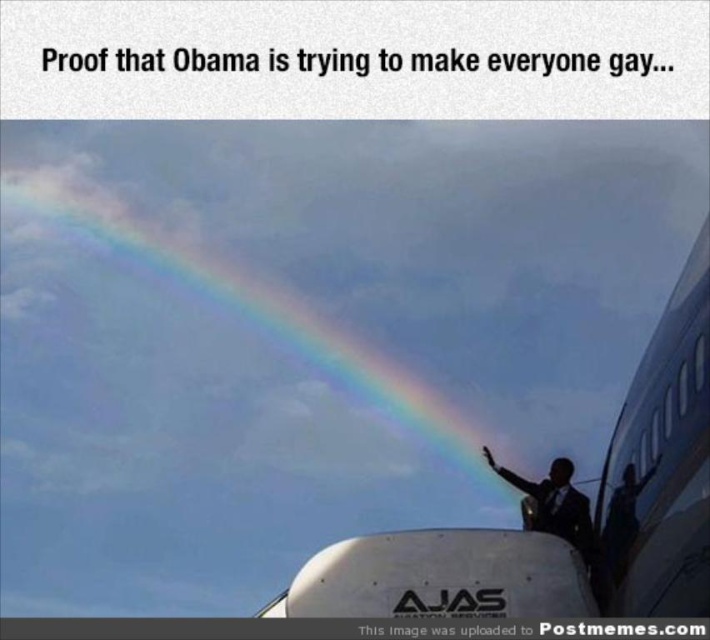
Question: Can you confirm if rainbow at center is bigger than dark suit at center?

Choices:
 (A) yes
 (B) no

Answer: (A)

Question: Which object is the closest to the white glossy airplane at lower right?

Choices:
 (A) dark suit at center
 (B) rainbow at center

Answer: (A)

Question: Is rainbow at center above dark suit at center?

Choices:
 (A) no
 (B) yes

Answer: (B)

Question: Among these objects, which one is farthest from the camera?

Choices:
 (A) dark suit at center
 (B) rainbow at center

Answer: (B)

Question: Which of the following is the closest to the observer?

Choices:
 (A) (x=545, y=515)
 (B) (x=474, y=576)

Answer: (B)

Question: Can you confirm if rainbow at center is thinner than dark suit at center?

Choices:
 (A) yes
 (B) no

Answer: (B)